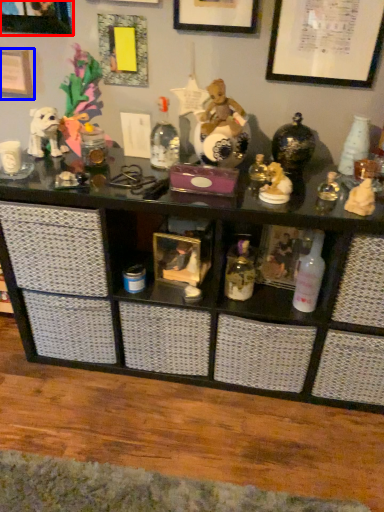
Question: Which object is further to the camera taking this photo, picture frame (highlighted by a red box) or picture frame (highlighted by a blue box)?

Choices:
 (A) picture frame
 (B) picture frame

Answer: (B)